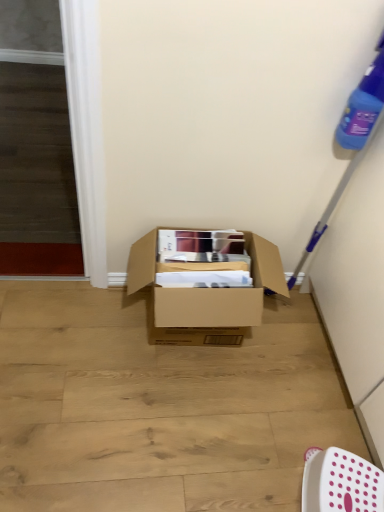
Find the location of a particular element. The height and width of the screenshot is (512, 384). free space behind white plastic chair at lower right is located at coordinates (310, 417).